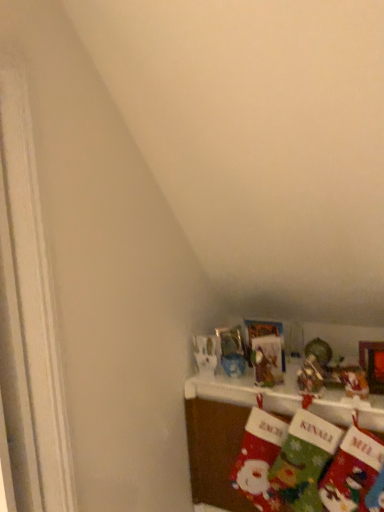
Identify the location of vacant space behind shiny metallic ornament at upper right, which is the 1th toy from right to left. The height and width of the screenshot is (512, 384). (322, 383).